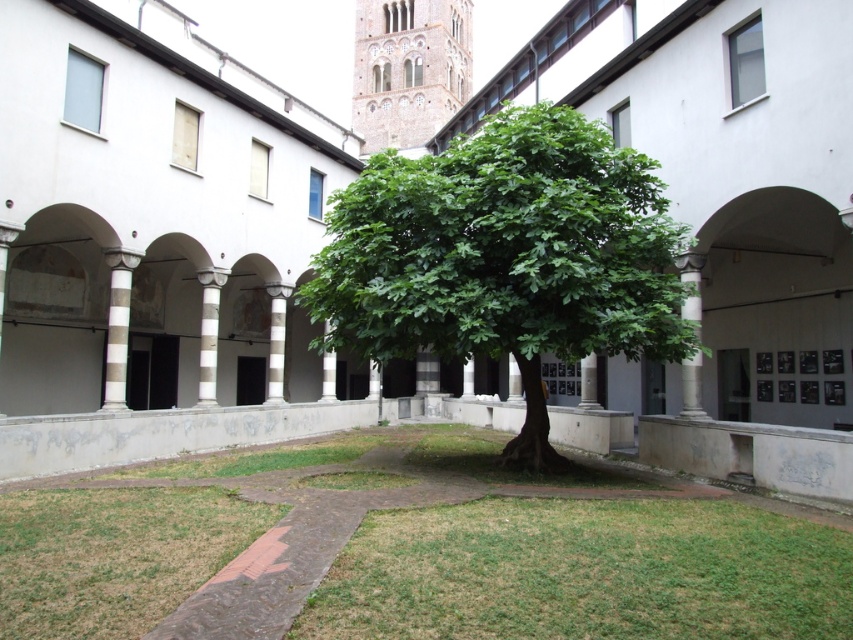
Which is behind, point (206, 308) or point (328, 368)?

The point (328, 368) is behind.

Can you confirm if white striped column at center is shorter than white marble pillar at center?

Incorrect, white striped column at center's height does not fall short of white marble pillar at center's.

Does point (207, 296) lie behind point (328, 328)?

No, it is in front of (328, 328).

This screenshot has width=853, height=640. I want to click on white striped column at center, so click(207, 337).

Describe the element at coordinates (505, 257) in the screenshot. Image resolution: width=853 pixels, height=640 pixels. I see `green leafy tree at center` at that location.

Consider the image. Is green leafy tree at center shorter than light beige stone tower at upper center?

Yes.

Is point (544, 220) less distant than point (387, 68)?

Yes, it is in front of point (387, 68).

Identify the location of green leafy tree at center. This screenshot has height=640, width=853. point(505,257).

Is light beige stone tower at upper center positioned before white striped pillar at center?

No, it is behind white striped pillar at center.

Measure the distance between light beige stone tower at upper center and white striped pillar at center.

light beige stone tower at upper center is 174.96 feet from white striped pillar at center.

Which is behind, point (392, 141) or point (271, 376)?

Point (392, 141)

You are a GUI agent. You are given a task and a screenshot of the screen. Output one action in this format:
    pyautogui.click(x=<x>, y=<y>)
    Task: Click on the light beige stone tower at upper center
    The height and width of the screenshot is (640, 853).
    Given the screenshot: What is the action you would take?
    pyautogui.click(x=408, y=68)